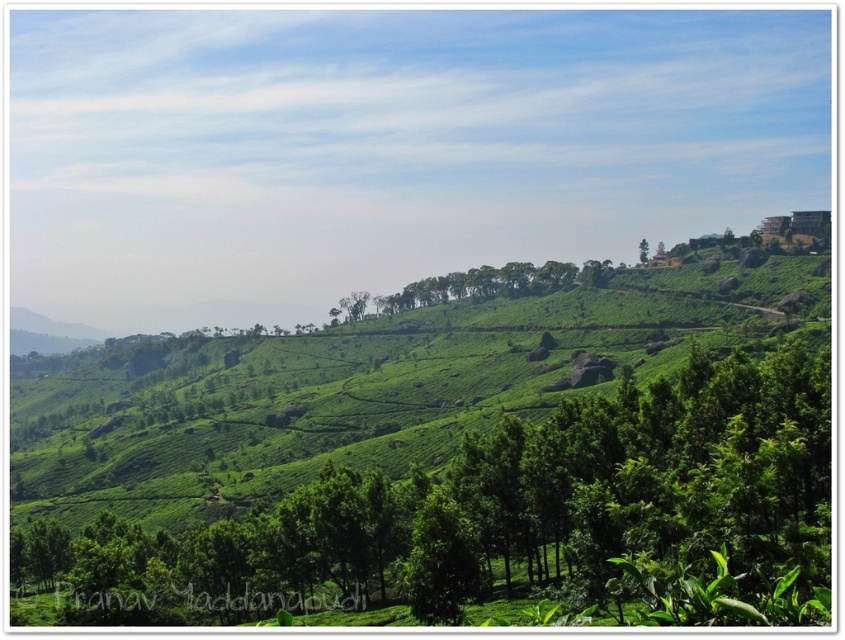
You are a hiker standing at the base of the hill looking towards the green leafy tree at center and the green leafy tree at upper right. Which tree appears taller from your vantage point?

The green leafy tree at upper right appears taller than the green leafy tree at center because it is taller in reality, and from your vantage point at the base of the hill, its height is more pronounced against the distant landscape.

You are a hiker standing at the bottom of the hill looking up at the green leafy tree at center and the green leafy tree at upper right. Which tree is closer to your left side?

The green leafy tree at center is positioned on the left side of green leafy tree at upper right, so the green leafy tree at center is closer to your left side.

You are a landscape architect planning to plant a new row of trees between the green leafy tree at center and the green leafy tree at upper right. Based on their widths, which tree should you use as a reference for spacing to ensure adequate growth space?

The green leafy tree at center has a greater width than the green leafy tree at upper right, so you should use the green leafy tree at center as a reference for spacing to ensure there is enough space for the new trees to grow properly.